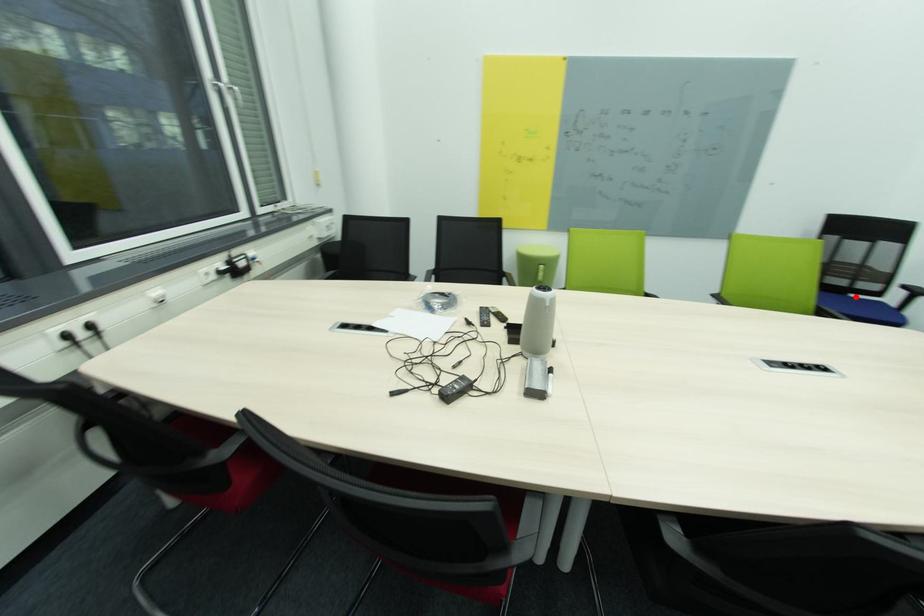
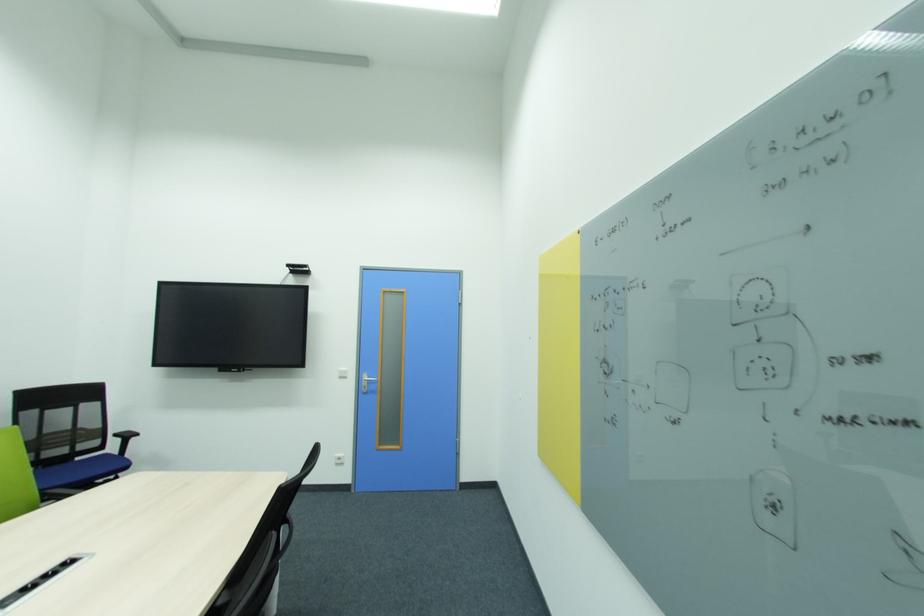
Where in the second image is the point corresponding to the highlighted location from the first image?

(82, 460)